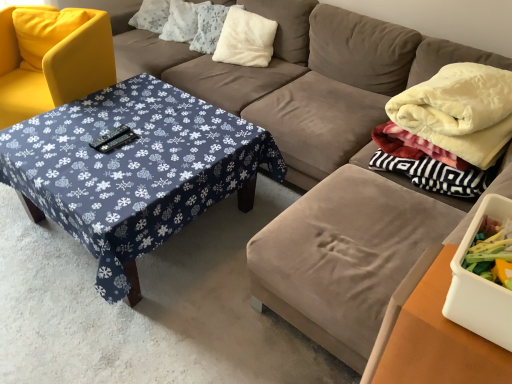
Locate an element on the screen. free point above blue fabric-covered table at center-left (from a real-world perspective) is located at coordinates (122, 146).